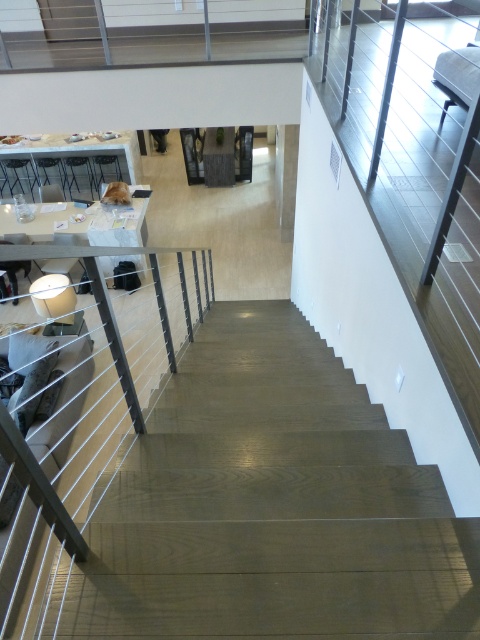
Is wooden stairs at center smaller than white glossy table at upper left?

Yes.

Which of these two, wooden stairs at center or white glossy table at upper left, stands taller?

Standing taller between the two is white glossy table at upper left.

Between point (231, 308) and point (82, 145), which one is positioned in front?

Positioned in front is point (231, 308).

Where is `wooden stairs at center`? The width and height of the screenshot is (480, 640). wooden stairs at center is located at coordinates (272, 506).

Who is higher up, white glossy table at upper left or white glossy table at upper center?

white glossy table at upper left

Is point (28, 188) behind point (40, 220)?

Yes, it is.

Where is `white glossy table at upper left`? Image resolution: width=480 pixels, height=640 pixels. white glossy table at upper left is located at coordinates (69, 163).

Locate an element on the screen. This screenshot has width=480, height=640. white glossy table at upper center is located at coordinates (79, 225).

Is white glossy table at upper center taller than dark brown leather jacket at upper center?

Indeed, white glossy table at upper center has a greater height compared to dark brown leather jacket at upper center.

Does point (112, 266) come in front of point (151, 132)?

Yes, it is.

You are a GUI agent. You are given a task and a screenshot of the screen. Output one action in this format:
    pyautogui.click(x=<x>, y=<y>)
    Task: Click on the white glossy table at upper center
    The height and width of the screenshot is (640, 480).
    Given the screenshot: What is the action you would take?
    pyautogui.click(x=79, y=225)